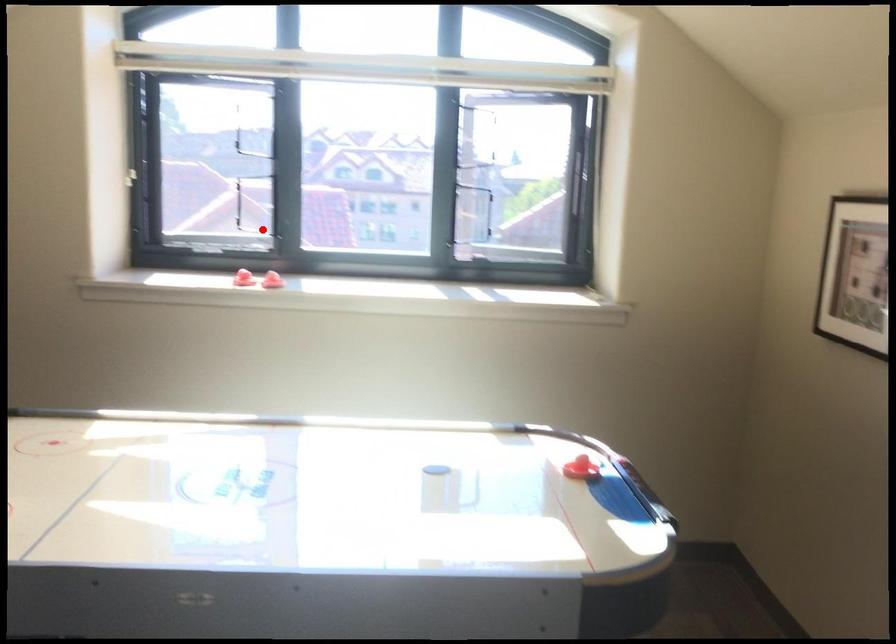
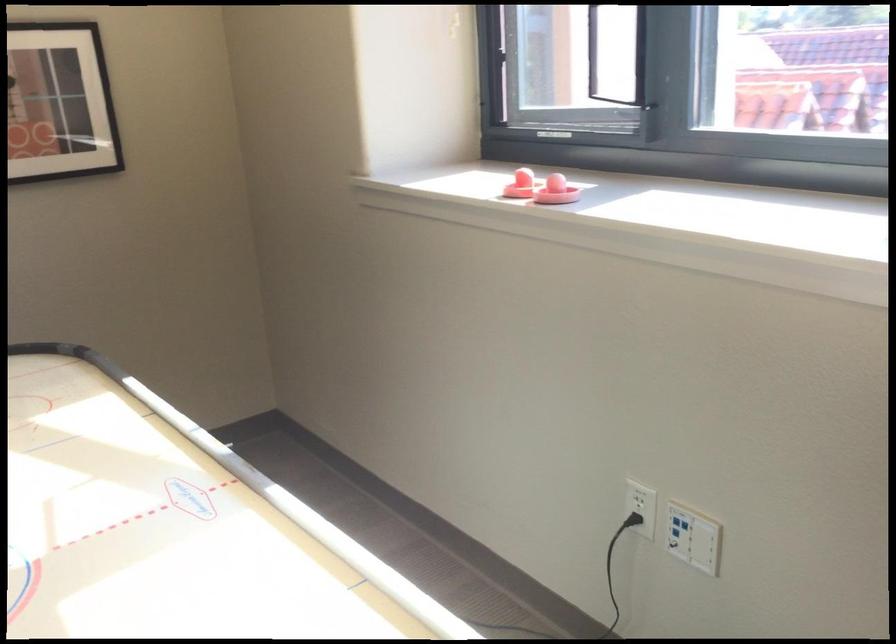
In the second image, find the point that corresponds to the highlighted location in the first image.

(638, 102)